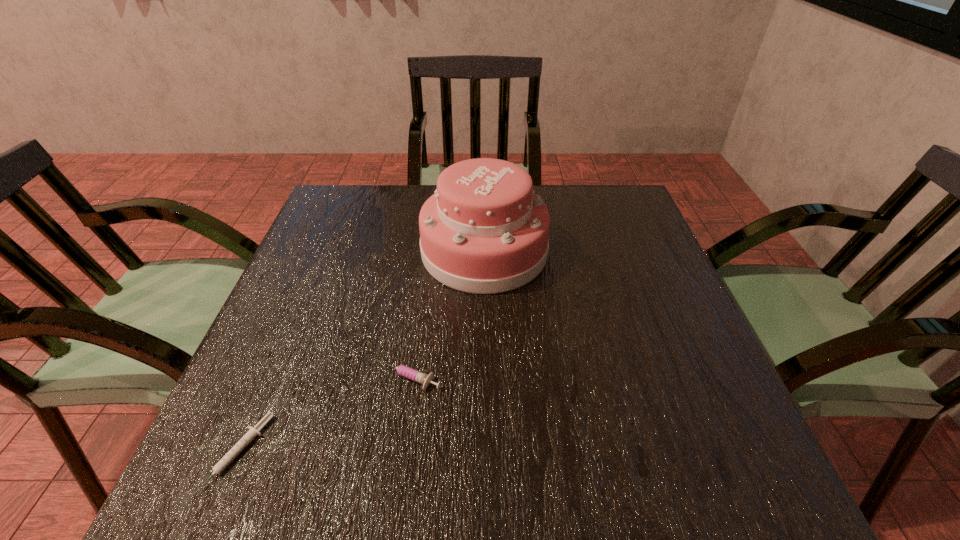
I want to click on birthday cake, so click(484, 231).

Identify the location of the tallest object. (484, 231).

Locate an element on the screen. This screenshot has height=540, width=960. the farther syringe is located at coordinates (402, 370).

In order to click on the taller syringe in this screenshot , I will do `click(402, 370)`.

Image resolution: width=960 pixels, height=540 pixels. Identify the location of the shortest object. (253, 431).

You are a GUI agent. You are given a task and a screenshot of the screen. Output one action in this format:
    pyautogui.click(x=<x>, y=<y>)
    Task: Click on the leftmost object
    This screenshot has width=960, height=540.
    Given the screenshot: What is the action you would take?
    pyautogui.click(x=253, y=431)

Image resolution: width=960 pixels, height=540 pixels. Identify the location of free space located on the right of the birthday cake. (595, 251).

Identify the location of free space located on the left of the second shortest object. (324, 377).

Where is `vacant space positioned on the back of the nearer syringe`? The image size is (960, 540). vacant space positioned on the back of the nearer syringe is located at coordinates (300, 307).

Locate an element on the screen. This screenshot has height=540, width=960. object at the far edge is located at coordinates (484, 231).